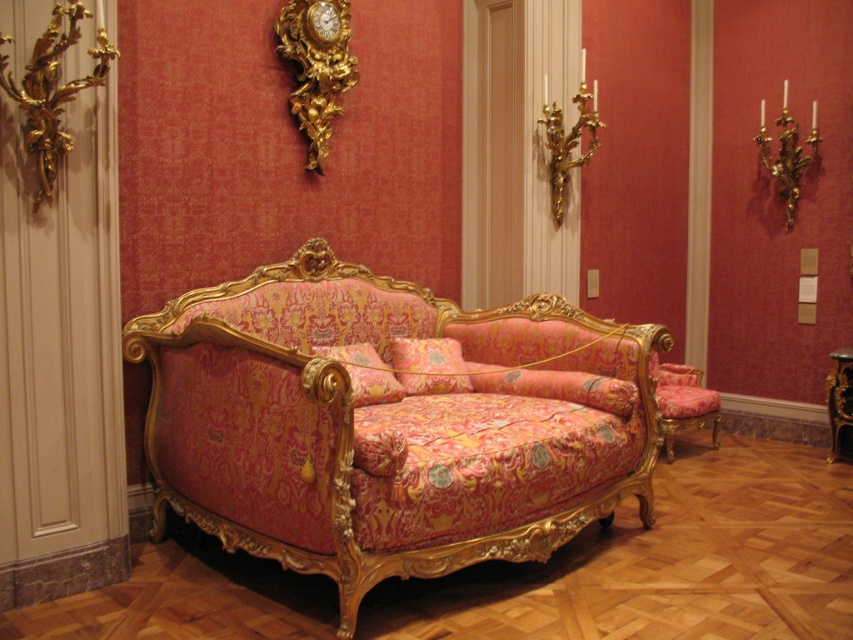
Can you confirm if gold-patterned fabric couch at center is wider than gold ornate clock at upper center?

Yes, gold-patterned fabric couch at center is wider than gold ornate clock at upper center.

Which is in front, point (534, 314) or point (314, 138)?

Point (314, 138) is more forward.

This screenshot has width=853, height=640. I want to click on gold-patterned fabric couch at center, so click(390, 422).

Identify the location of gold-patterned fabric couch at center. This screenshot has height=640, width=853. (390, 422).

Image resolution: width=853 pixels, height=640 pixels. Describe the element at coordinates (390, 422) in the screenshot. I see `gold-patterned fabric couch at center` at that location.

Find the location of a particular element. This screenshot has height=640, width=853. gold-patterned fabric couch at center is located at coordinates 390,422.

Who is shorter, gold ornate clock at upper center or velvet floral armchair at center?

With less height is velvet floral armchair at center.

Describe the element at coordinates (316, 67) in the screenshot. The image size is (853, 640). I see `gold ornate clock at upper center` at that location.

Find the location of a particular element. The width and height of the screenshot is (853, 640). gold ornate clock at upper center is located at coordinates (316, 67).